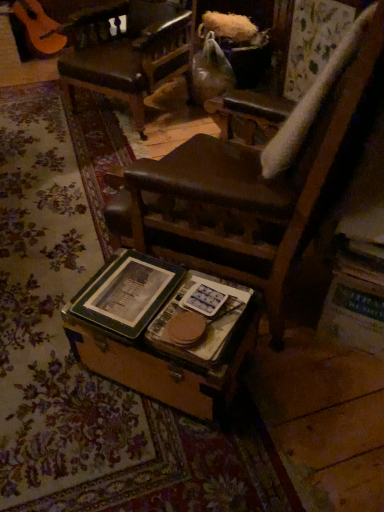
Where is `free space on the front side of wooden trunk at center`? free space on the front side of wooden trunk at center is located at coordinates (169, 458).